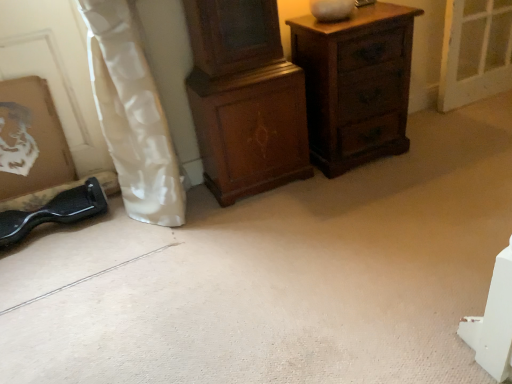
Question: Is wooden cabinet at center, positioned as the first chest of drawers in left-to-right order, further to camera compared to white glossy curtain at left?

Choices:
 (A) no
 (B) yes

Answer: (B)

Question: Does wooden cabinet at center, which ranks as the 2th chest of drawers in right-to-left order, have a larger size compared to white glossy curtain at left?

Choices:
 (A) no
 (B) yes

Answer: (A)

Question: Is wooden cabinet at center, positioned as the first chest of drawers in left-to-right order, thinner than white glossy curtain at left?

Choices:
 (A) yes
 (B) no

Answer: (A)

Question: From the image's perspective, does wooden cabinet at center, positioned as the first chest of drawers in left-to-right order, appear higher than white glossy curtain at left?

Choices:
 (A) yes
 (B) no

Answer: (A)

Question: Could you tell me if wooden cabinet at center, which ranks as the 2th chest of drawers in right-to-left order, is facing white glossy curtain at left?

Choices:
 (A) no
 (B) yes

Answer: (A)

Question: From a real-world perspective, is wooden chest of drawers at upper right, the first chest of drawers in the right-to-left sequence, physically located above or below wooden picture frame at lower left?

Choices:
 (A) below
 (B) above

Answer: (A)

Question: In terms of width, does wooden chest of drawers at upper right, the first chest of drawers in the right-to-left sequence, look wider or thinner when compared to wooden picture frame at lower left?

Choices:
 (A) wide
 (B) thin

Answer: (A)

Question: Is wooden chest of drawers at upper right, the first chest of drawers in the right-to-left sequence, situated inside wooden picture frame at lower left or outside?

Choices:
 (A) inside
 (B) outside

Answer: (B)

Question: Considering the positions of wooden chest of drawers at upper right, which appears as the 2th chest of drawers when viewed from the left, and wooden picture frame at lower left in the image, is wooden chest of drawers at upper right, which appears as the 2th chest of drawers when viewed from the left, taller or shorter than wooden picture frame at lower left?

Choices:
 (A) short
 (B) tall

Answer: (B)

Question: Choose the correct answer: Is wooden cabinet at center, positioned as the first chest of drawers in left-to-right order, inside wooden chest of drawers at upper right, which appears as the 2th chest of drawers when viewed from the left, or outside it?

Choices:
 (A) inside
 (B) outside

Answer: (B)

Question: Is wooden cabinet at center, positioned as the first chest of drawers in left-to-right order, taller or shorter than wooden chest of drawers at upper right, the first chest of drawers in the right-to-left sequence?

Choices:
 (A) tall
 (B) short

Answer: (A)

Question: Based on their positions, is wooden cabinet at center, which ranks as the 2th chest of drawers in right-to-left order, located to the left or right of wooden chest of drawers at upper right, which appears as the 2th chest of drawers when viewed from the left?

Choices:
 (A) right
 (B) left

Answer: (B)

Question: Considering their positions, is wooden cabinet at center, which ranks as the 2th chest of drawers in right-to-left order, located in front of or behind wooden chest of drawers at upper right, the first chest of drawers in the right-to-left sequence?

Choices:
 (A) front
 (B) behind

Answer: (A)

Question: From a real-world perspective, relative to wooden picture frame at lower left, is wooden cabinet at center, positioned as the first chest of drawers in left-to-right order, vertically above or below?

Choices:
 (A) above
 (B) below

Answer: (A)

Question: Is wooden cabinet at center, which ranks as the 2th chest of drawers in right-to-left order, inside or outside of wooden picture frame at lower left?

Choices:
 (A) outside
 (B) inside

Answer: (A)